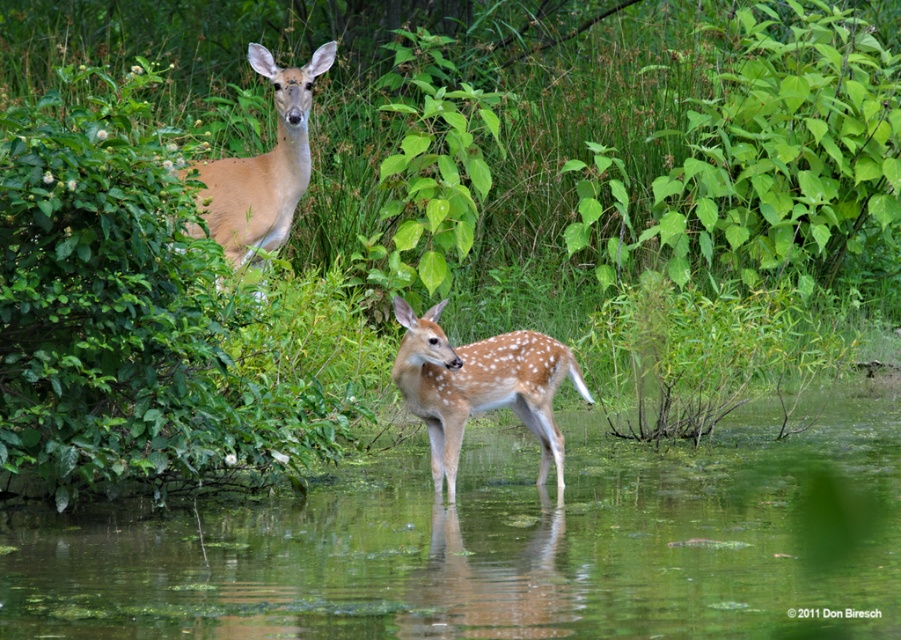
Question: Is green liquid water at lower center to the right of light brown fur at upper left from the viewer's perspective?

Choices:
 (A) yes
 (B) no

Answer: (A)

Question: Which object is the farthest from the light brown fur at upper left?

Choices:
 (A) fawn fur deer at center
 (B) green liquid water at lower center

Answer: (B)

Question: Which object is the farthest from the green liquid water at lower center?

Choices:
 (A) fawn fur deer at center
 (B) light brown fur at upper left

Answer: (B)

Question: Is fawn fur deer at center below light brown fur at upper left?

Choices:
 (A) yes
 (B) no

Answer: (A)

Question: Which of the following is the closest to the observer?

Choices:
 (A) fawn fur deer at center
 (B) green liquid water at lower center
 (C) light brown fur at upper left

Answer: (B)

Question: Is green liquid water at lower center closer to camera compared to fawn fur deer at center?

Choices:
 (A) no
 (B) yes

Answer: (B)